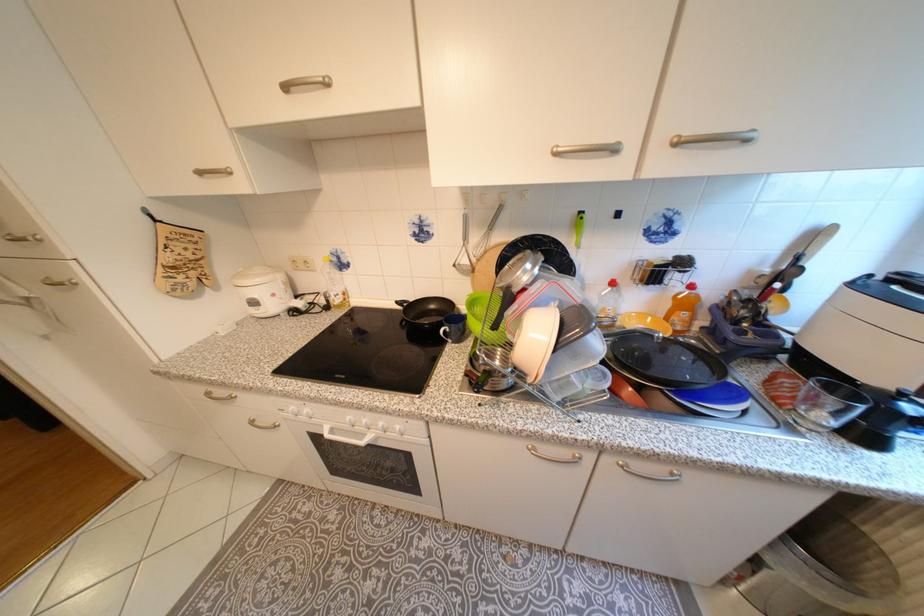
This screenshot has height=616, width=924. Describe the element at coordinates (444, 333) in the screenshot. I see `a blue mug handle` at that location.